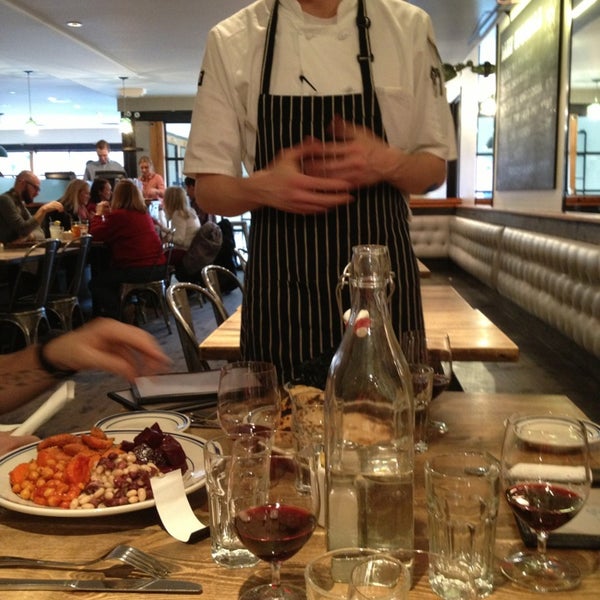
Where is `hanging light`? hanging light is located at coordinates (30, 132), (123, 130).